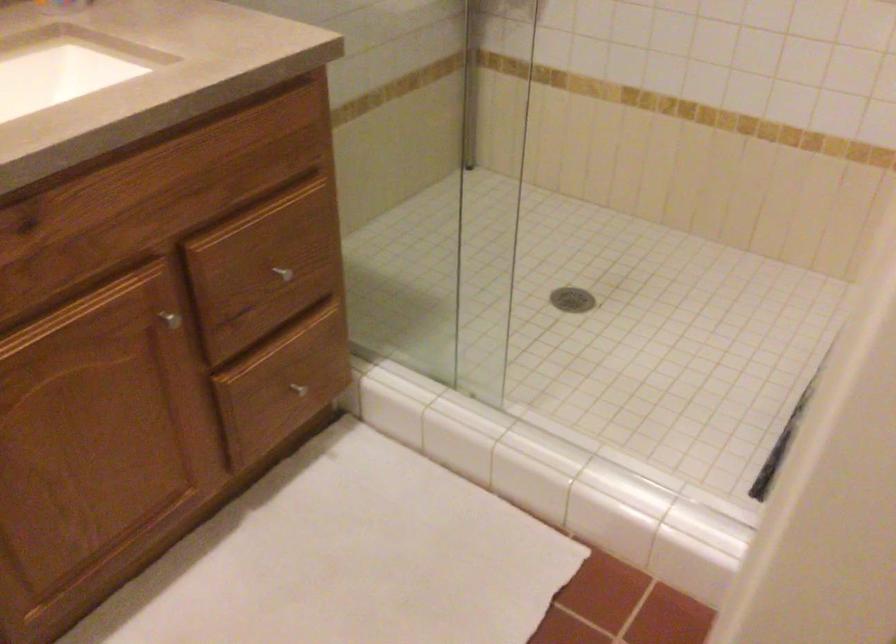
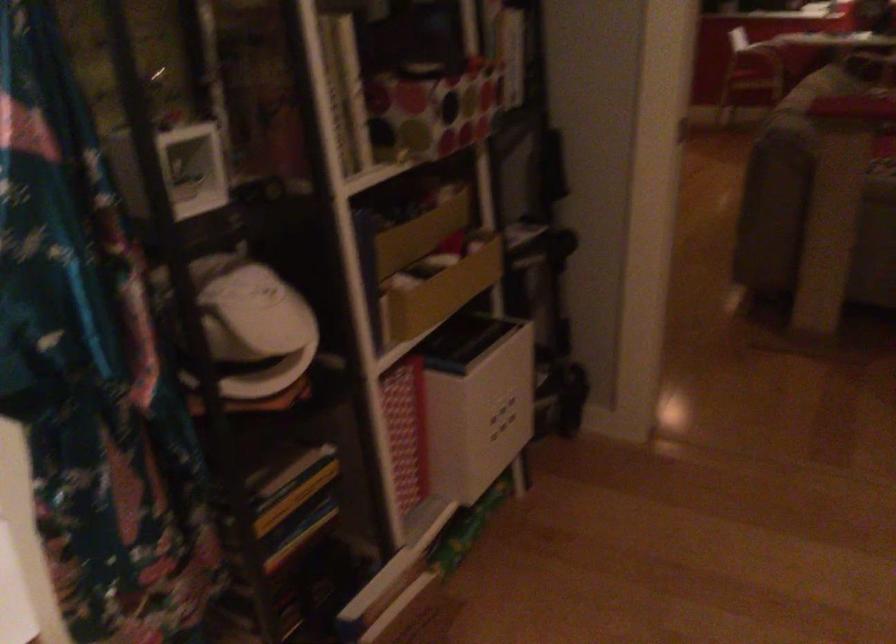
The images are taken continuously from a first-person perspective. In which direction are you moving?

The movement direction of the cameraman is right, backward.